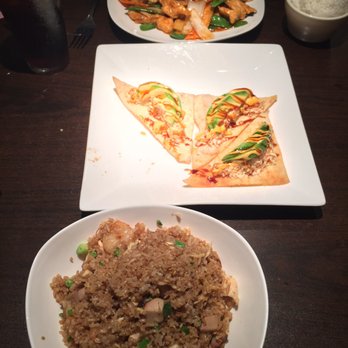
You are a GUI agent. You are given a task and a screenshot of the screen. Output one action in this format:
    pyautogui.click(x=<x>, y=<y>)
    Task: Click on the bowl
    This screenshot has width=348, height=348.
    Given the screenshot: What is the action you would take?
    pyautogui.click(x=309, y=35)